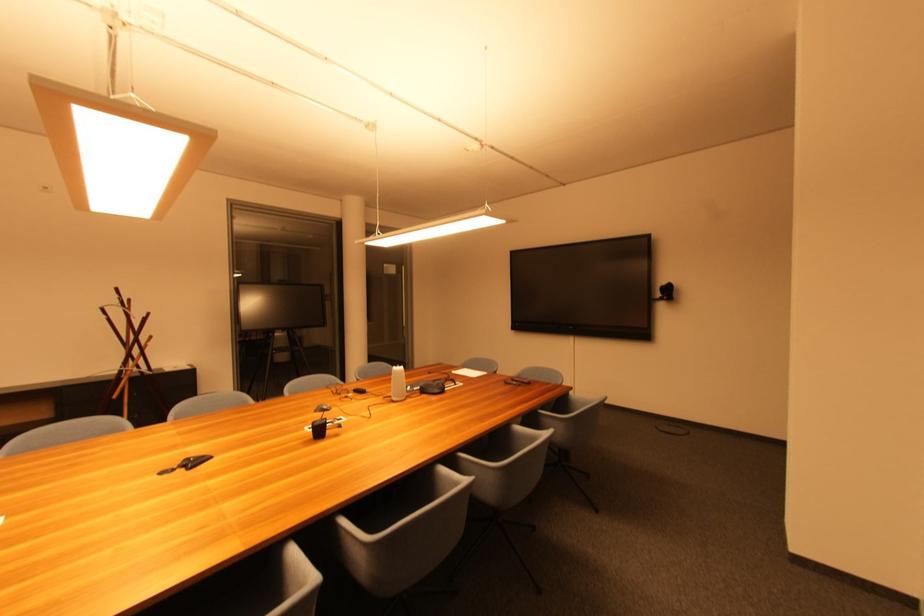
The width and height of the screenshot is (924, 616). In order to click on grey chair sitting surface in this screenshot , I will do `click(391, 512)`.